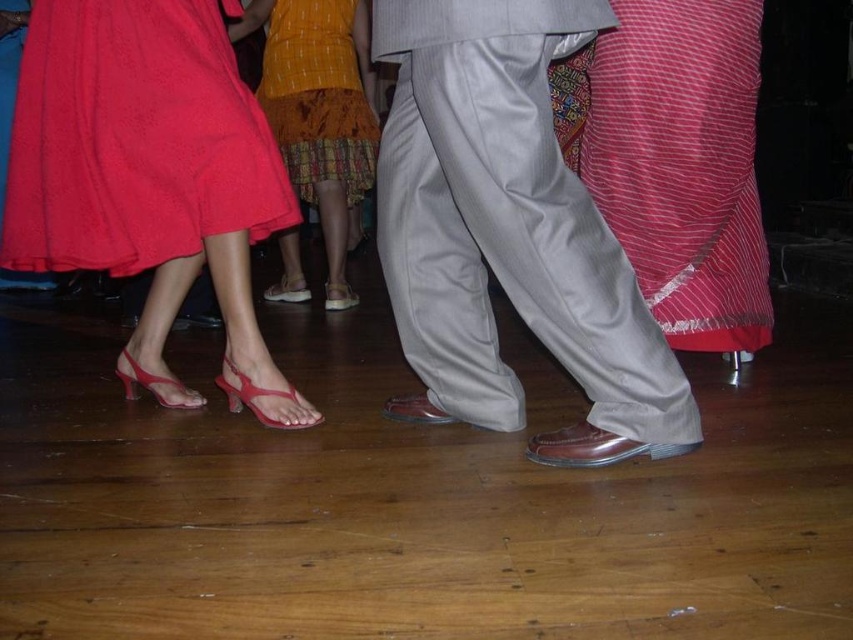
You are a GUI agent. You are given a task and a screenshot of the screen. Output one action in this format:
    pyautogui.click(x=<x>, y=<y>)
    Task: Click on the matte leather shoes at center
    This screenshot has height=640, width=853.
    Given the screenshot: What is the action you would take?
    pyautogui.click(x=511, y=230)

Who is more forward, (601, 6) or (38, 189)?

Point (601, 6) is in front.

Identify the location of matte leather shoes at center. (511, 230).

Does light gray trousers at center appear over yellow printed fabric at center?

Actually, light gray trousers at center is below yellow printed fabric at center.

Which is above, light gray trousers at center or yellow printed fabric at center?

yellow printed fabric at center

Locate an element on the screen. light gray trousers at center is located at coordinates (509, 230).

Which is more to the left, matte red skirt at lower left or red striped fabric at right?

matte red skirt at lower left is more to the left.

Find the location of a particular element. The width and height of the screenshot is (853, 640). matte red skirt at lower left is located at coordinates (134, 140).

Locate an element on the screen. This screenshot has height=640, width=853. matte red skirt at lower left is located at coordinates (134, 140).